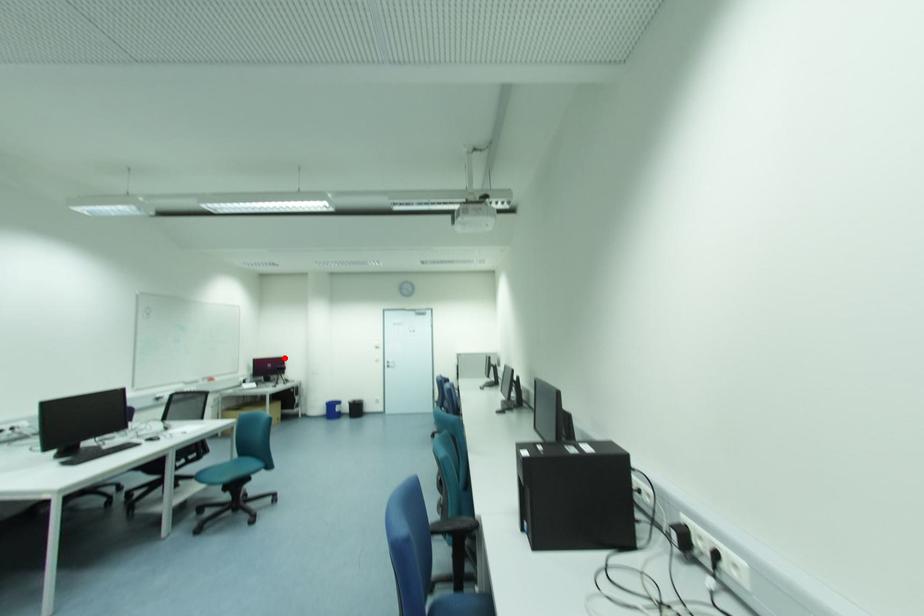
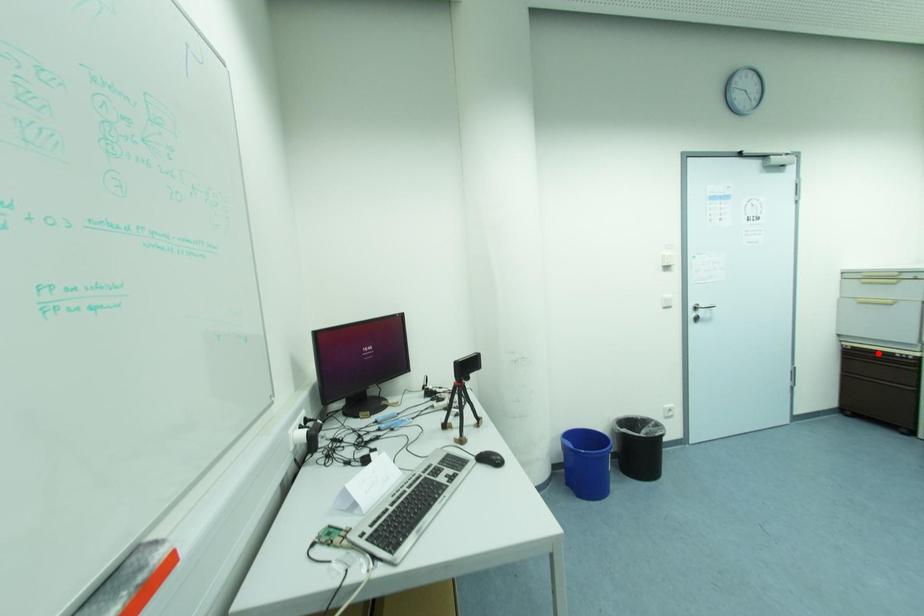
I am providing you with two images of the same scene from different viewpoints. A red point is marked on the first image and another point is marked on the second image. Is the red point in image1 aligned with the point shown in image2?

No